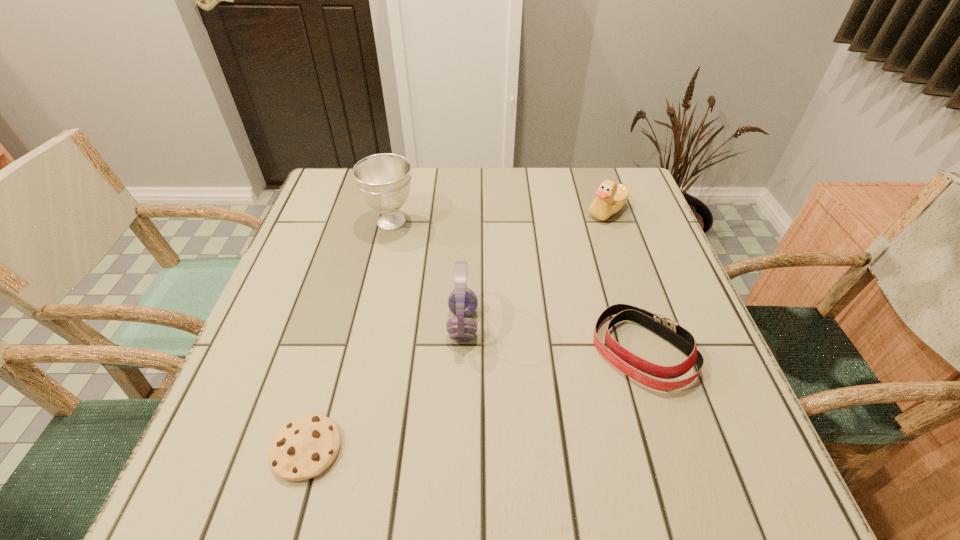
Image resolution: width=960 pixels, height=540 pixels. I want to click on free space between the second shortest object and the third object from right to left, so click(x=553, y=338).

Locate an element on the screen. This screenshot has height=540, width=960. free space between the third shortest object and the chalice is located at coordinates (499, 217).

Find the location of `unoccupied area between the headset and the chalice`. unoccupied area between the headset and the chalice is located at coordinates (427, 273).

The image size is (960, 540). In order to click on unoccupied area between the third object from left to right and the chalice in this screenshot , I will do `click(427, 273)`.

The width and height of the screenshot is (960, 540). Find the location of `free space between the third tallest object and the chalice`. free space between the third tallest object and the chalice is located at coordinates (499, 217).

Locate an element on the screen. Image resolution: width=960 pixels, height=540 pixels. vacant region between the headset and the third shortest object is located at coordinates (535, 268).

Locate an element on the screen. free space between the shortest object and the headset is located at coordinates (385, 387).

You are a GUI agent. You are given a task and a screenshot of the screen. Output one action in this format:
    pyautogui.click(x=<x>, y=<y>)
    Task: Click on the vacant area that lies between the cookie and the second shortest object
    The height and width of the screenshot is (540, 960).
    Given the screenshot: What is the action you would take?
    pyautogui.click(x=474, y=400)

Locate which object is the third closest to the third shortest object. Please provide its 2D coordinates. Your answer should be formatted as a tuple, i.e. [(x, y)], where the tuple contains the x and y coordinates of a point satisfying the conditions above.

[(384, 180)]

Identify which object is the third nearest to the third shortest object. Please provide its 2D coordinates. Your answer should be formatted as a tuple, i.e. [(x, y)], where the tuple contains the x and y coordinates of a point satisfying the conditions above.

[(384, 180)]